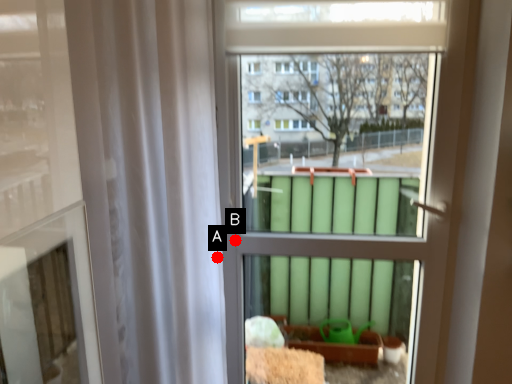
Question: Two points are circled on the image, labeled by A and B beside each circle. Which point is farther to the camera?

Choices:
 (A) A is further
 (B) B is further

Answer: (B)